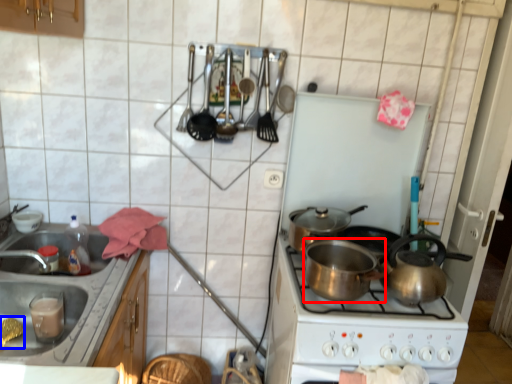
Question: Which object is closer to the camera taking this photo, kitchen appliance (highlighted by a red box) or food (highlighted by a blue box)?

Choices:
 (A) kitchen appliance
 (B) food

Answer: (A)